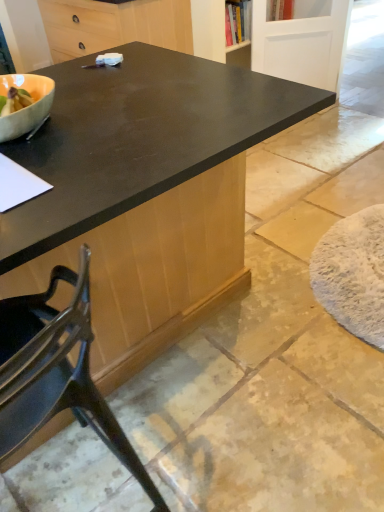
Question: From a real-world perspective, is black matte cabinet at upper center above or below metallic black chair at lower left?

Choices:
 (A) above
 (B) below

Answer: (A)

Question: In terms of height, does black matte cabinet at upper center look taller or shorter compared to metallic black chair at lower left?

Choices:
 (A) short
 (B) tall

Answer: (A)

Question: Estimate the real-world distances between objects in this image. Which object is farther from the black matte cabinet at upper center?

Choices:
 (A) metallic black chair at lower left
 (B) white painted wood screen door at upper right

Answer: (A)

Question: Which object is positioned closest to the metallic black chair at lower left?

Choices:
 (A) black matte cabinet at upper center
 (B) white painted wood screen door at upper right

Answer: (A)